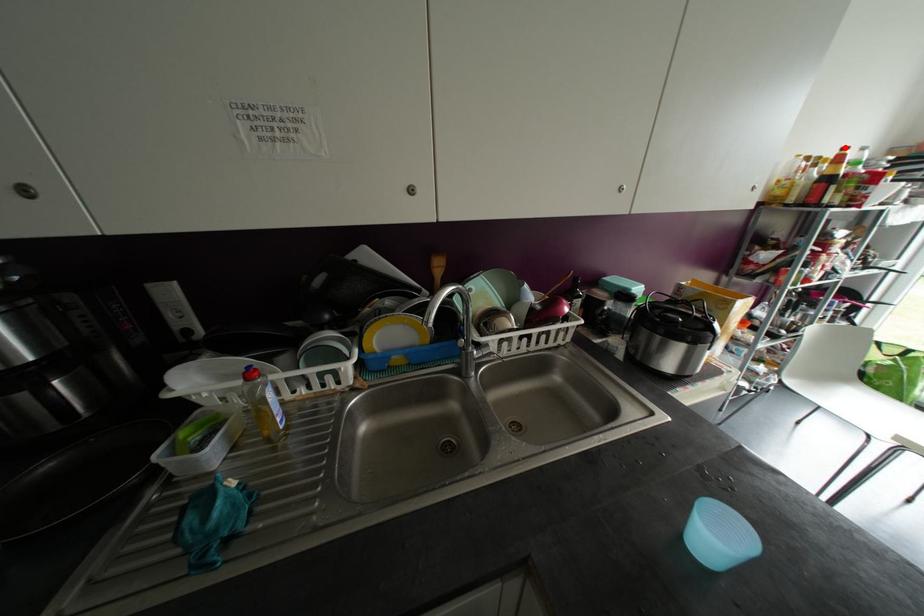
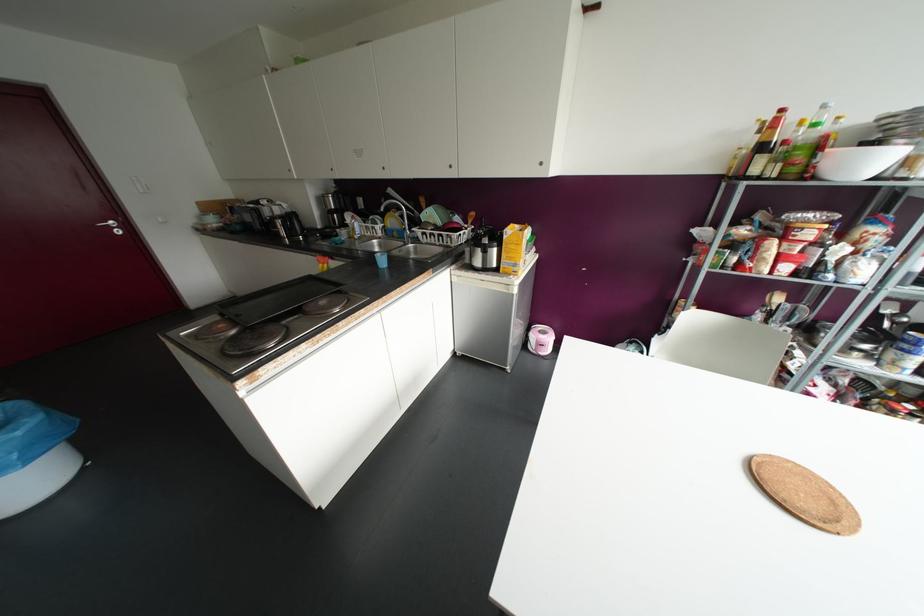
The point at the highlighted location is marked in the first image. Where is the corresponding point in the second image?

(781, 110)